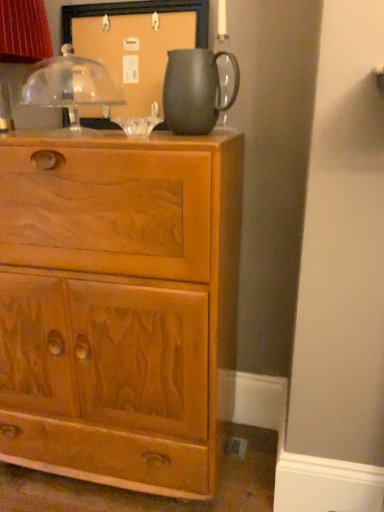
This screenshot has width=384, height=512. Describe the element at coordinates (195, 90) in the screenshot. I see `matte black pitcher at upper center` at that location.

Describe the element at coordinates (195, 90) in the screenshot. This screenshot has width=384, height=512. I see `matte black pitcher at upper center` at that location.

Measure the distance between point (176,122) and camera.

Point (176,122) is 3.56 feet away from camera.

At what (x,y) coordinates should I click in order to perform the action: click on light brown wood chest of drawers at center. Please return your answer as a coordinate pair (x, y). Looking at the image, I should click on (119, 305).

From the image's perspective, which object appears higher, matte black pitcher at upper center or light brown wood chest of drawers at center?

matte black pitcher at upper center is shown above in the image.

Can you confirm if matte black pitcher at upper center is wider than light brown wood chest of drawers at center?

Incorrect, the width of matte black pitcher at upper center does not surpass that of light brown wood chest of drawers at center.

Can you see matte black pitcher at upper center touching light brown wood chest of drawers at center?

No, matte black pitcher at upper center is not in contact with light brown wood chest of drawers at center.

In the scene shown: Can you confirm if matte black pitcher at upper center is wider than light brown wood chest of drawers at center?

No.

Locate an element on the screen. Image resolution: width=384 pixels, height=512 pixels. tea set that appears on the right of light brown wood chest of drawers at center is located at coordinates (195, 90).

Does matte black pitcher at upper center turn towards light brown wood chest of drawers at center?

No, matte black pitcher at upper center is not facing towards light brown wood chest of drawers at center.

Is matte black pitcher at upper center inside or outside of light brown wood chest of drawers at center?

matte black pitcher at upper center is not inside light brown wood chest of drawers at center, it's outside.

Could you tell me if matte black pitcher at upper center is turned towards matte black pitcher at upper center?

No, matte black pitcher at upper center is not turned towards matte black pitcher at upper center.

Would you say matte black pitcher at upper center is outside matte black pitcher at upper center?

Indeed, matte black pitcher at upper center is completely outside matte black pitcher at upper center.

Does matte black pitcher at upper center have a lesser width compared to matte black pitcher at upper center?

No.

Considering the points (199, 134) and (92, 66), which point is behind, point (199, 134) or point (92, 66)?

Point (92, 66)

Is point (159, 307) farther from camera compared to point (192, 133)?

No, it is in front of (192, 133).

Considering the relative positions of light brown wood chest of drawers at center and matte black pitcher at upper center in the image provided, is light brown wood chest of drawers at center behind matte black pitcher at upper center?

That is False.

This screenshot has width=384, height=512. Find the location of `the chest of drawers below the matte black pitcher at upper center (from the image's perspective)`. the chest of drawers below the matte black pitcher at upper center (from the image's perspective) is located at coordinates (119, 305).

Is there a large distance between light brown wood chest of drawers at center and matte black pitcher at upper center?

light brown wood chest of drawers at center is near matte black pitcher at upper center, not far away.

Image resolution: width=384 pixels, height=512 pixels. Find the location of `jug in front of the matte black pitcher at upper center`. jug in front of the matte black pitcher at upper center is located at coordinates (195, 90).

How distant is matte black pitcher at upper center from matte black pitcher at upper center?

matte black pitcher at upper center is 15.39 inches from matte black pitcher at upper center.

Considering the sizes of objects matte black pitcher at upper center and matte black pitcher at upper center in the image provided, who is bigger, matte black pitcher at upper center or matte black pitcher at upper center?

matte black pitcher at upper center is bigger.

Is matte black pitcher at upper center not near matte black pitcher at upper center?

Actually, matte black pitcher at upper center and matte black pitcher at upper center are a little close together.

Is point (12, 269) less distant than point (192, 104)?

No, (12, 269) is further to viewer.

Are light brown wood chest of drawers at center and matte black pitcher at upper center far apart?

No.

Considering the sizes of light brown wood chest of drawers at center and matte black pitcher at upper center in the image, is light brown wood chest of drawers at center taller or shorter than matte black pitcher at upper center?

Clearly, light brown wood chest of drawers at center is taller compared to matte black pitcher at upper center.

Considering the sizes of objects light brown wood chest of drawers at center and matte black pitcher at upper center in the image provided, who is bigger, light brown wood chest of drawers at center or matte black pitcher at upper center?

With larger size is light brown wood chest of drawers at center.

Where is `jug above the light brown wood chest of drawers at center (from a real-world perspective)`? This screenshot has height=512, width=384. jug above the light brown wood chest of drawers at center (from a real-world perspective) is located at coordinates (195, 90).

At what (x,y) coordinates should I click in order to perform the action: click on chest of drawers on the left of matte black pitcher at upper center. Please return your answer as a coordinate pair (x, y). Image resolution: width=384 pixels, height=512 pixels. Looking at the image, I should click on (119, 305).

Looking at the image, which one is located further to matte black pitcher at upper center, light brown wood chest of drawers at center or matte black pitcher at upper center?

Based on the image, light brown wood chest of drawers at center appears to be further to matte black pitcher at upper center.

Looking at the image, which one is located closer to matte black pitcher at upper center, matte black pitcher at upper center or light brown wood chest of drawers at center?

matte black pitcher at upper center is closer to matte black pitcher at upper center.

Based on their spatial positions, is matte black pitcher at upper center or light brown wood chest of drawers at center further from matte black pitcher at upper center?

light brown wood chest of drawers at center is further to matte black pitcher at upper center.

Considering their positions, is matte black pitcher at upper center positioned closer to light brown wood chest of drawers at center than matte black pitcher at upper center?

Based on the image, matte black pitcher at upper center appears to be nearer to light brown wood chest of drawers at center.

From the image, which object appears to be farther from light brown wood chest of drawers at center, matte black pitcher at upper center or matte black pitcher at upper center?

matte black pitcher at upper center is further to light brown wood chest of drawers at center.

Considering their positions, is light brown wood chest of drawers at center positioned closer to matte black pitcher at upper center than matte black pitcher at upper center?

matte black pitcher at upper center is positioned closer to the anchor matte black pitcher at upper center.

Locate an element on the screen. The image size is (384, 512). jug between matte black pitcher at upper center and light brown wood chest of drawers at center from top to bottom is located at coordinates (195, 90).